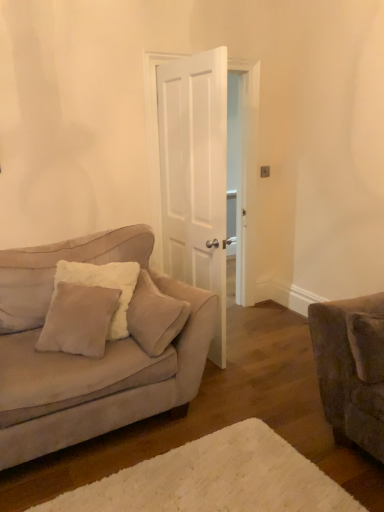
Where is `empty space that is ontop of white fluffy rug at lower center (from a real-world perspective)`? The width and height of the screenshot is (384, 512). empty space that is ontop of white fluffy rug at lower center (from a real-world perspective) is located at coordinates (212, 478).